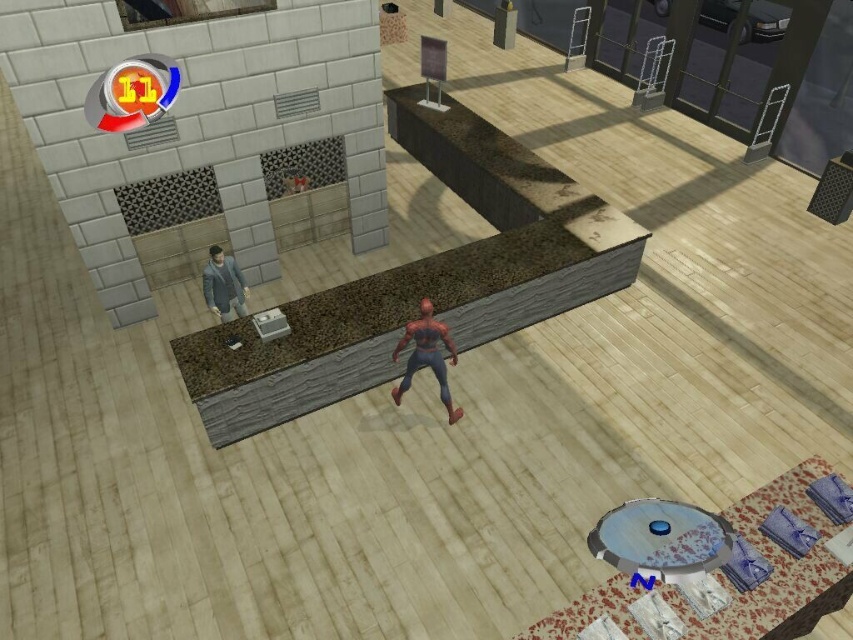
In the scene shown: Between shiny spandex suit at center and smooth gray suit at left, which one is positioned lower?

shiny spandex suit at center is lower down.

Which is in front, point (428, 321) or point (225, 253)?

Point (428, 321)

Who is more forward, (451, 356) or (219, 262)?

Point (219, 262) is more forward.

Find the location of a particular element. The image size is (853, 640). shiny spandex suit at center is located at coordinates (426, 355).